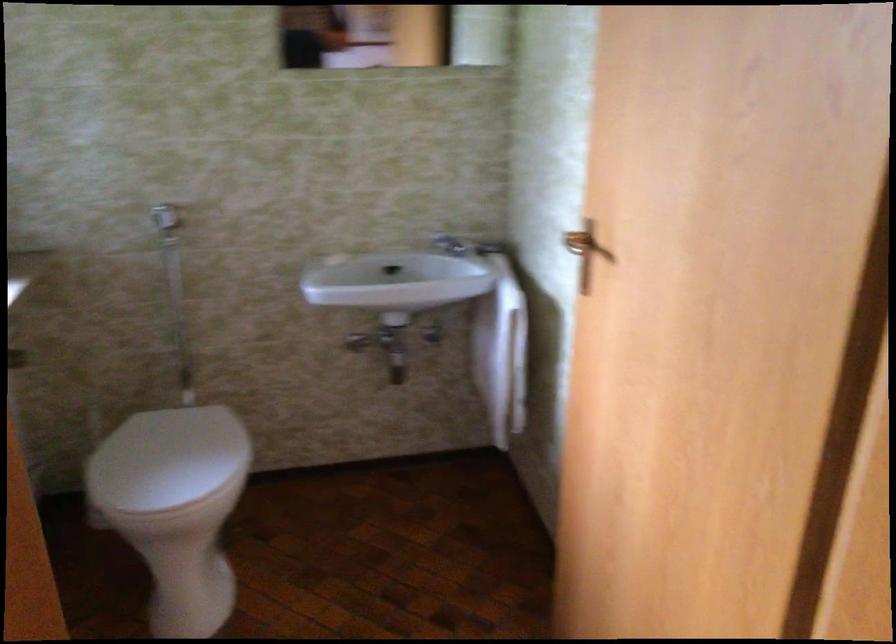
You are a GUI agent. You are given a task and a screenshot of the screen. Output one action in this format:
    pyautogui.click(x=<x>, y=<y>)
    Task: Click on the metal door handle
    
    Given the screenshot: What is the action you would take?
    pyautogui.click(x=578, y=242)